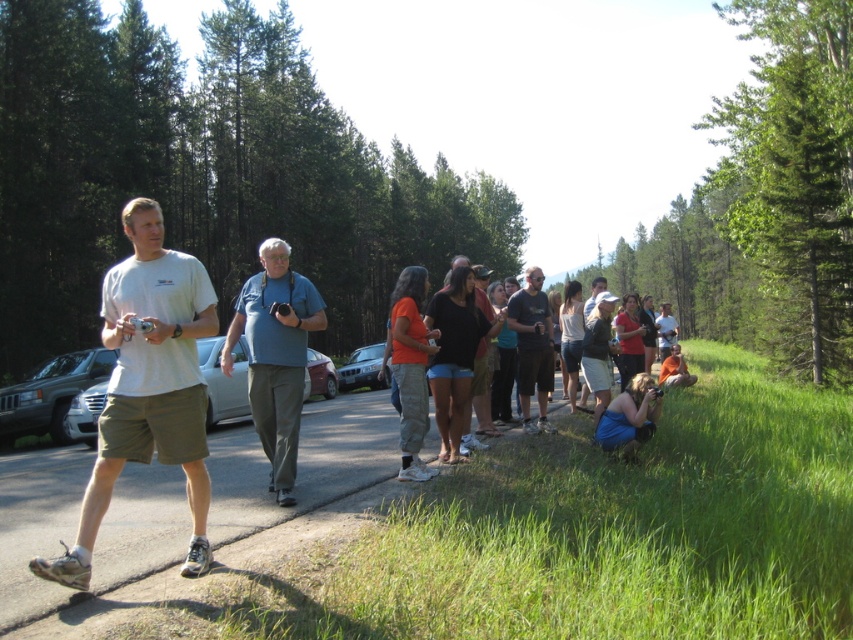
Does dark gray t-shirt at center appear on the right side of matte blue shirt at center?

In fact, dark gray t-shirt at center is to the left of matte blue shirt at center.

Between dark gray t-shirt at center and matte blue shirt at center, which one has less height?

dark gray t-shirt at center

Describe the element at coordinates (532, 348) in the screenshot. I see `dark gray t-shirt at center` at that location.

Where is `dark gray t-shirt at center`? Image resolution: width=853 pixels, height=640 pixels. dark gray t-shirt at center is located at coordinates point(532,348).

Is orange cotton shirt at center shorter than matte blue shirt at center?

Indeed, orange cotton shirt at center has a lesser height compared to matte blue shirt at center.

Is orange cotton shirt at center taller than matte blue shirt at center?

In fact, orange cotton shirt at center may be shorter than matte blue shirt at center.

Measure the distance between point [407,442] and camera.

A distance of 23.84 feet exists between point [407,442] and camera.

Image resolution: width=853 pixels, height=640 pixels. In order to click on orange cotton shirt at center in this screenshot , I will do 410,368.

Which is in front, point (224, 417) or point (672, 358)?

Point (224, 417) is in front.

Is silver metallic car at left further to camera compared to brown fabric backpack at lower right?

That is False.

Who is more forward, (325, 390) or (663, 381)?

Positioned in front is point (663, 381).

Where is `silver metallic car at left`? The width and height of the screenshot is (853, 640). silver metallic car at left is located at coordinates (224, 380).